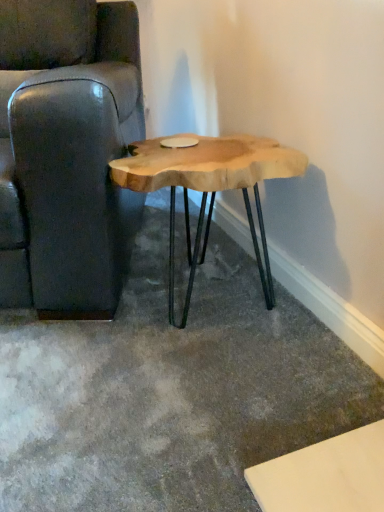
Question: Considering the relative sizes of leather couch at left and natural wood table at center in the image provided, is leather couch at left thinner than natural wood table at center?

Choices:
 (A) yes
 (B) no

Answer: (B)

Question: Considering the relative positions of leather couch at left and natural wood table at center in the image provided, is leather couch at left to the right of natural wood table at center from the viewer's perspective?

Choices:
 (A) no
 (B) yes

Answer: (A)

Question: From the image's perspective, is leather couch at left below natural wood table at center?

Choices:
 (A) no
 (B) yes

Answer: (A)

Question: Can you confirm if leather couch at left is wider than natural wood table at center?

Choices:
 (A) yes
 (B) no

Answer: (A)

Question: Considering the relative positions of leather couch at left and natural wood table at center in the image provided, is leather couch at left behind natural wood table at center?

Choices:
 (A) no
 (B) yes

Answer: (A)

Question: From a real-world perspective, is leather couch at left beneath natural wood table at center?

Choices:
 (A) yes
 (B) no

Answer: (B)

Question: Does natural wood table at center lie behind leather couch at left?

Choices:
 (A) no
 (B) yes

Answer: (B)

Question: Would you say natural wood table at center is a long distance from leather couch at left?

Choices:
 (A) no
 (B) yes

Answer: (A)

Question: From a real-world perspective, is natural wood table at center physically above leather couch at left?

Choices:
 (A) no
 (B) yes

Answer: (A)

Question: Considering the relative positions of natural wood table at center and leather couch at left in the image provided, is natural wood table at center to the left of leather couch at left from the viewer's perspective?

Choices:
 (A) no
 (B) yes

Answer: (A)

Question: Does natural wood table at center have a smaller size compared to leather couch at left?

Choices:
 (A) no
 (B) yes

Answer: (B)

Question: Is natural wood table at center not inside leather couch at left?

Choices:
 (A) no
 (B) yes

Answer: (B)

Question: In terms of height, does leather couch at left look taller or shorter compared to natural wood table at center?

Choices:
 (A) tall
 (B) short

Answer: (A)